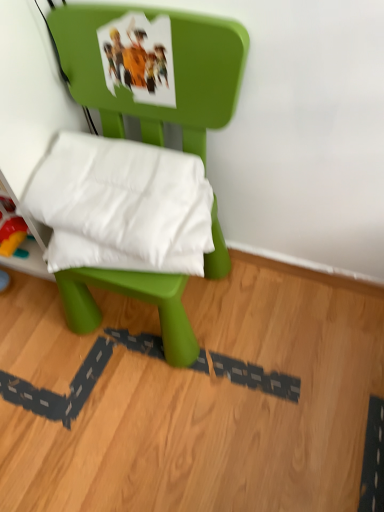
Image resolution: width=384 pixels, height=512 pixels. In order to click on vacant space situated on the left part of green plastic chair at center in this screenshot , I will do `click(37, 352)`.